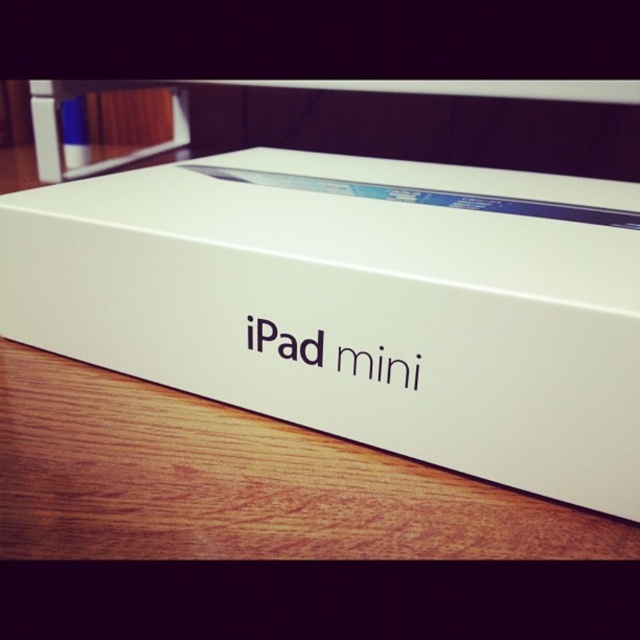
You are a delivery person who just received a package. You need to place it on a wooden table. The package has to be centered exactly at the point with coordinates (x=356, y=304). Can you confirm if the white matte ipad mini at center is already placed correctly?

The point (x=356, y=304) corresponds to the white matte ipad mini at center, so yes, it is already placed correctly.

You are trying to place a small gift card on the wooden table at lower center but there is a white matte ipad mini at center in the way. Can you still place the gift card on the table without moving the ipad?

The white matte ipad mini at center is positioned over the wooden table at lower center, so there is space around it to place the gift card without moving the iPad.

You are a delivery person who needs to place a 10 inch wide package on the wooden table at lower center. The white matte ipad mini at center is already on the table. Can you fit the package next to it without overlapping?

The distance between the white matte ipad mini at center and the wooden table at lower center is 8.19 inches. Since the package is 10 inches wide, it would not fit next to the white matte ipad mini at center without overlapping as the available space is smaller than the package width.